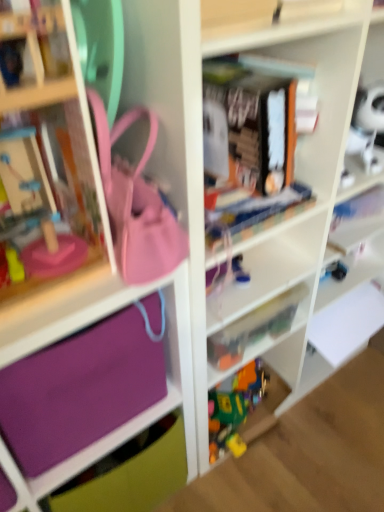
Question: Is purple fabric bag at left, which appears as the first cabinet when viewed from the right, smaller than matte pink purse at center?

Choices:
 (A) no
 (B) yes

Answer: (A)

Question: Are purple fabric bag at left, which appears as the first cabinet when viewed from the right, and matte pink purse at center located far from each other?

Choices:
 (A) yes
 (B) no

Answer: (B)

Question: From the image's perspective, is purple fabric bag at left, which appears as the first cabinet when viewed from the right, under matte pink purse at center?

Choices:
 (A) yes
 (B) no

Answer: (A)

Question: Does purple fabric bag at left, which appears as the first cabinet when viewed from the right, have a greater width compared to matte pink purse at center?

Choices:
 (A) yes
 (B) no

Answer: (A)

Question: Is the position of purple fabric bag at left, which appears as the first cabinet when viewed from the right, more distant than that of matte pink purse at center?

Choices:
 (A) yes
 (B) no

Answer: (A)

Question: Is point (269, 324) positioned closer to the camera than point (292, 216)?

Choices:
 (A) closer
 (B) farther

Answer: (B)

Question: Is translucent plastic toys at center inside the boundaries of purple fabric bag at left, which appears as the first cabinet when viewed from the right, or outside?

Choices:
 (A) inside
 (B) outside

Answer: (A)

Question: Based on their sizes in the image, would you say translucent plastic toys at center is bigger or smaller than purple fabric bag at left, which is the 2th cabinet from left to right?

Choices:
 (A) big
 (B) small

Answer: (B)

Question: Considering the relative positions of translucent plastic toys at center and purple fabric bag at left, which is the 2th cabinet from left to right, in the image provided, is translucent plastic toys at center to the left or to the right of purple fabric bag at left, which is the 2th cabinet from left to right,?

Choices:
 (A) right
 (B) left

Answer: (B)

Question: Considering the positions of purple fabric bag at left, which is the 2th cabinet from left to right, and matte pink purse at center in the image, is purple fabric bag at left, which is the 2th cabinet from left to right, bigger or smaller than matte pink purse at center?

Choices:
 (A) small
 (B) big

Answer: (B)

Question: Based on their positions, is purple fabric bag at left, which appears as the first cabinet when viewed from the right, located to the left or right of matte pink purse at center?

Choices:
 (A) right
 (B) left

Answer: (A)

Question: Considering the positions of purple fabric bag at left, which appears as the first cabinet when viewed from the right, and matte pink purse at center in the image, is purple fabric bag at left, which appears as the first cabinet when viewed from the right, taller or shorter than matte pink purse at center?

Choices:
 (A) short
 (B) tall

Answer: (B)

Question: From the image's perspective, is purple fabric bag at left, which is the 2th cabinet from left to right, located above or below matte pink purse at center?

Choices:
 (A) below
 (B) above

Answer: (A)

Question: From their relative heights in the image, would you say matte pink purse at center is taller or shorter than purple fabric bag at left, which appears as the first cabinet when viewed from the right?

Choices:
 (A) short
 (B) tall

Answer: (A)

Question: From the image's perspective, relative to purple fabric bag at left, which is the 2th cabinet from left to right, is matte pink purse at center above or below?

Choices:
 (A) below
 (B) above

Answer: (B)